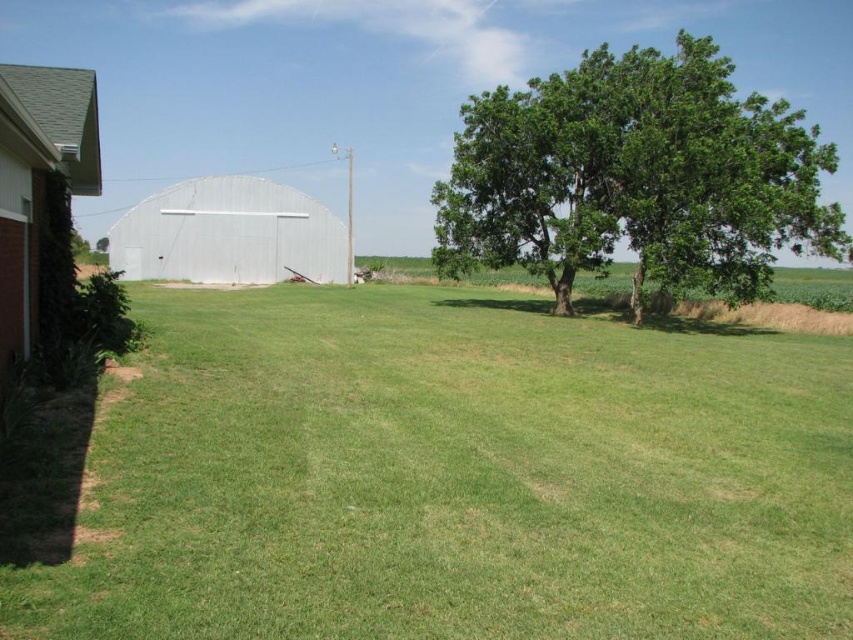
Question: Is green leafy tree at upper right positioned behind brick/red brick barn at left?

Choices:
 (A) yes
 (B) no

Answer: (A)

Question: Among these objects, which one is farthest from the camera?

Choices:
 (A) green leafy tree at upper right
 (B) brick/red brick barn at left

Answer: (A)

Question: Which of the following is the closest to the observer?

Choices:
 (A) brick/red brick barn at left
 (B) green leafy tree at upper right

Answer: (A)

Question: Can you confirm if green leafy tree at upper right is positioned to the left of white metallic barn at center?

Choices:
 (A) yes
 (B) no

Answer: (B)

Question: Which point is closer to the camera?

Choices:
 (A) white metallic barn at center
 (B) brick/red brick barn at left

Answer: (B)

Question: Can you confirm if green leafy tree at upper right is thinner than white metallic barn at center?

Choices:
 (A) yes
 (B) no

Answer: (B)